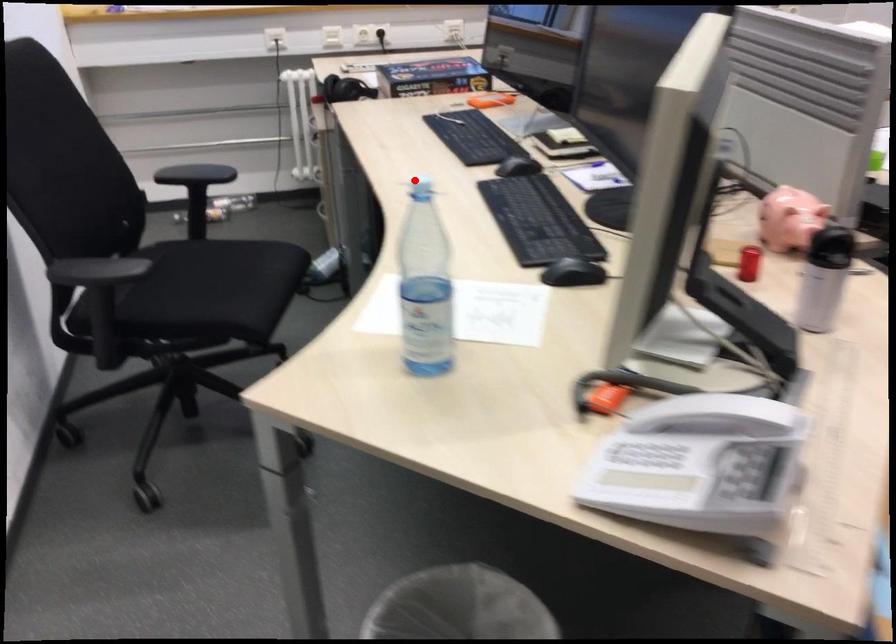
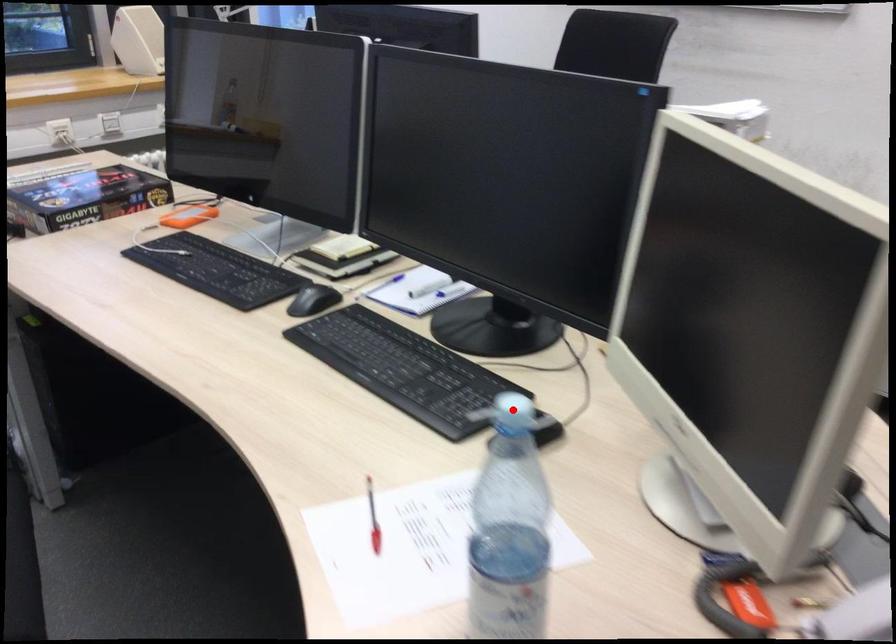
I am providing you with two images of the same scene from different viewpoints. A red point is marked on the first image and another point is marked on the second image. Is the red point in image1 aligned with the point shown in image2?

Yes